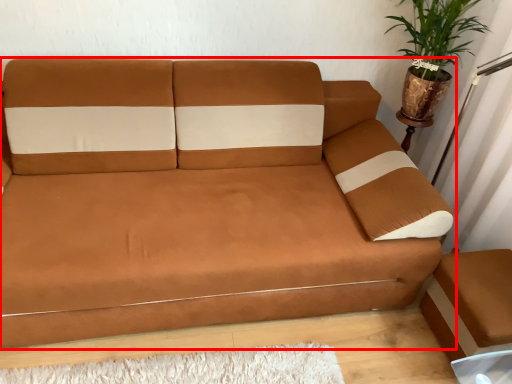
Question: From the image's perspective, where is studio couch (annotated by the red box) located relative to houseplant?

Choices:
 (A) above
 (B) below

Answer: (B)